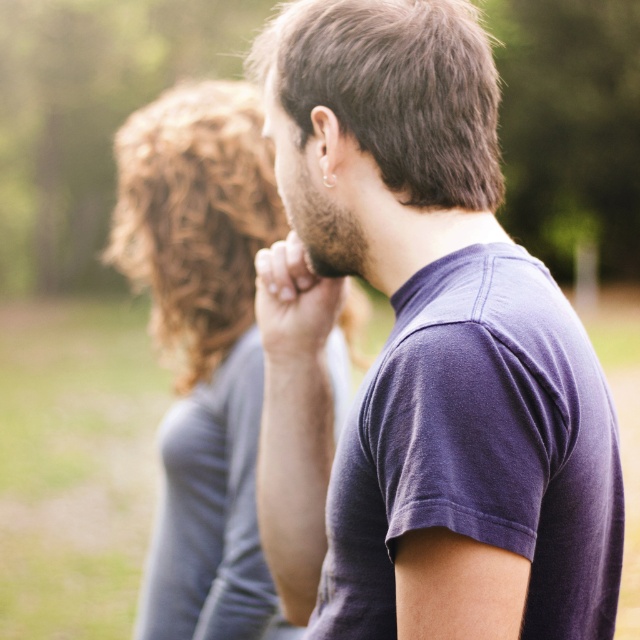
Is purple cotton t-shirt at center above matte skin hand at center?

Yes.

Identify the location of purple cotton t-shirt at center. (440, 340).

The image size is (640, 640). Identify the location of purple cotton t-shirt at center. (440, 340).

Between purple cotton t-shirt at center and smooth gray shirt at center, which one appears on the right side from the viewer's perspective?

Positioned to the right is purple cotton t-shirt at center.

Measure the distance between purple cotton t-shirt at center and smooth gray shirt at center.

The distance of purple cotton t-shirt at center from smooth gray shirt at center is 86.12 centimeters.

Which is behind, point (586, 369) or point (214, 356)?

Positioned behind is point (214, 356).

The image size is (640, 640). Find the location of `purple cotton t-shirt at center`. purple cotton t-shirt at center is located at coordinates (440, 340).

Does smooth gray shirt at center have a lesser height compared to matte skin hand at center?

No, smooth gray shirt at center is not shorter than matte skin hand at center.

Does point (189, 177) lie behind point (272, 356)?

That is True.

Find the location of a particular element. The width and height of the screenshot is (640, 640). smooth gray shirt at center is located at coordinates tap(202, 346).